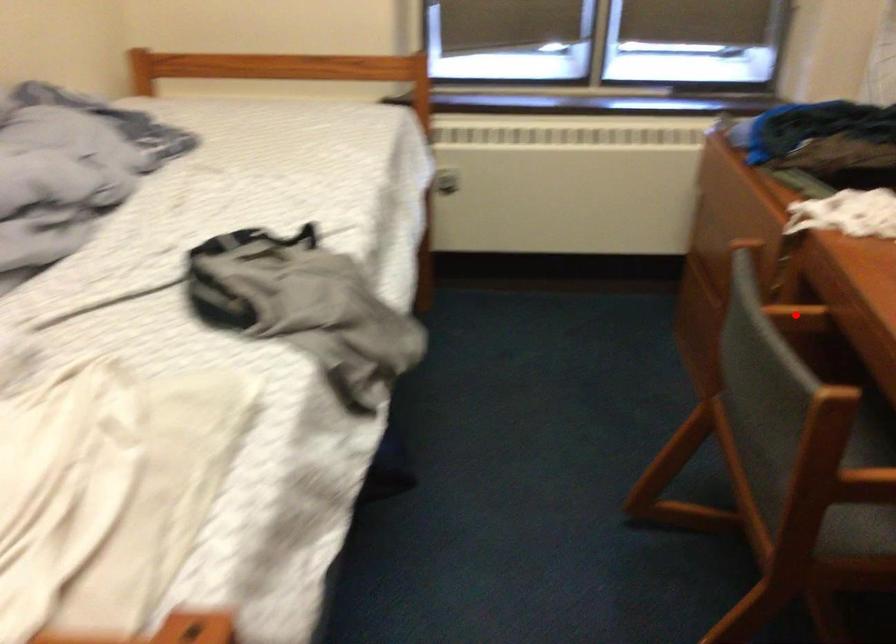
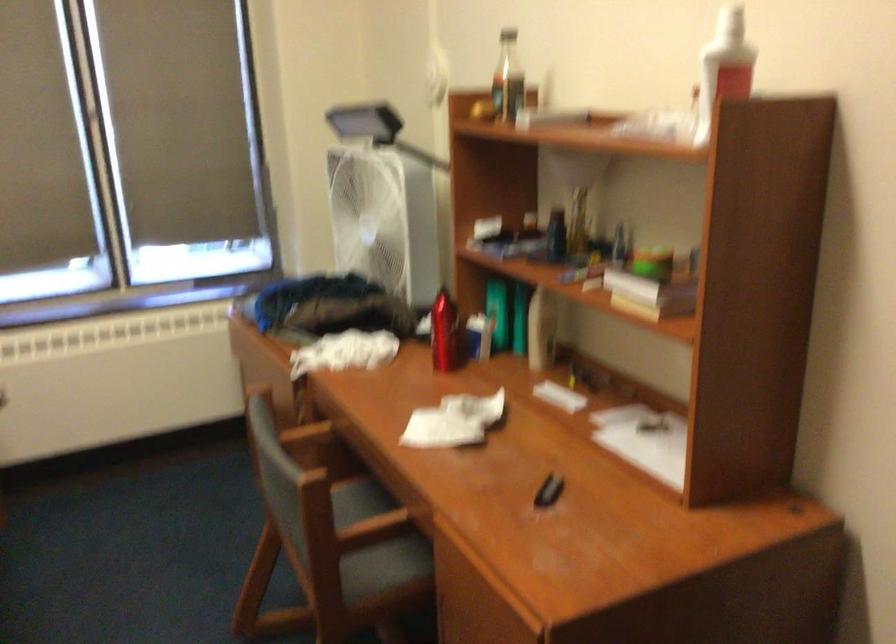
Question: I am providing you with two images of the same scene from different viewpoints. Given a red point in image1, look at the same physical point in image2. Is it:

Choices:
 (A) Closer to the viewpoint
 (B) Farther from the viewpoint

Answer: (B)